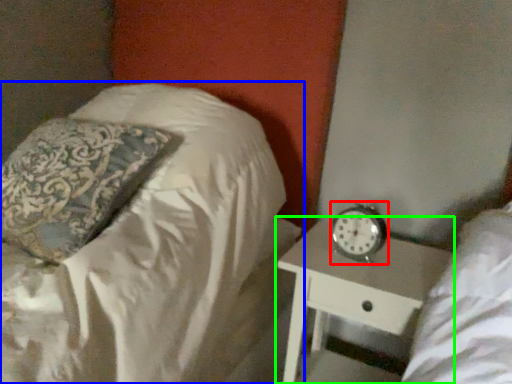
Question: Considering the real-world distances, which object is closest to clock (highlighted by a red box)? bed (highlighted by a blue box) or nightstand (highlighted by a green box).

Choices:
 (A) bed
 (B) nightstand

Answer: (B)